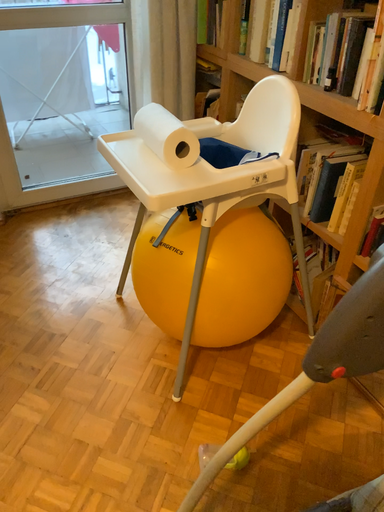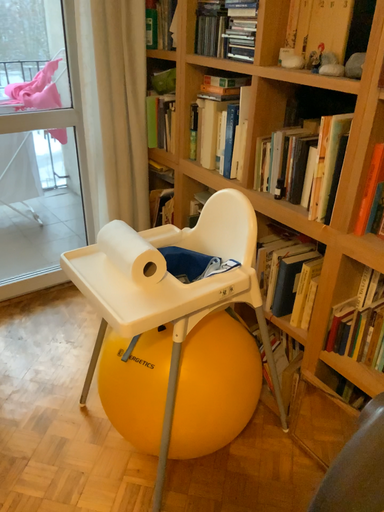
Question: Which way did the camera rotate in the video?

Choices:
 (A) rotated left
 (B) rotated right

Answer: (B)